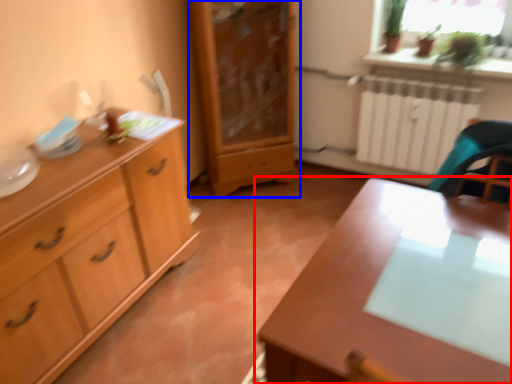
Question: Which point is further to the camera, table (highlighted by a red box) or chest of drawers (highlighted by a blue box)?

Choices:
 (A) table
 (B) chest of drawers

Answer: (B)